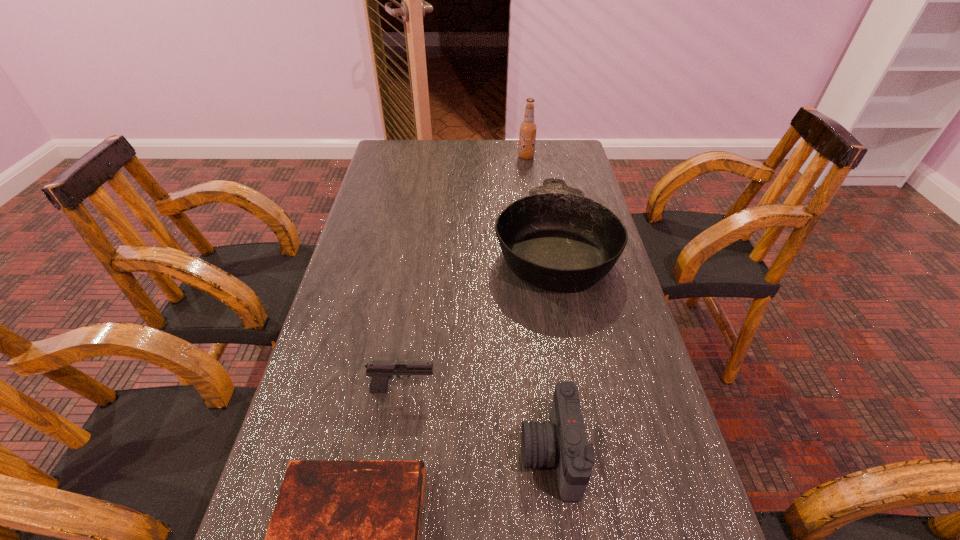
Identify the location of beer bottle. (527, 137).

The width and height of the screenshot is (960, 540). Identify the location of the farthest object. (527, 137).

You are a GUI agent. You are given a task and a screenshot of the screen. Output one action in this format:
    pyautogui.click(x=<x>, y=<y>)
    Task: Click on the frying pan
    
    Given the screenshot: What is the action you would take?
    point(556,239)

The height and width of the screenshot is (540, 960). In order to click on camera in this screenshot , I will do `click(562, 441)`.

I want to click on pistol, so click(x=380, y=372).

In order to click on the second shortest object in this screenshot , I will do `click(380, 372)`.

Locate an element on the screen. This screenshot has width=960, height=540. vacant position located 0.290m on the front label of the farthest object is located at coordinates (439, 157).

At what (x,y) coordinates should I click in order to perform the action: click on vacant position located on the front label of the farthest object. Please return your answer as a coordinate pair (x, y). Looking at the image, I should click on (449, 157).

Find the location of `vacant space positioned 0.230m on the front label of the farthest object`. vacant space positioned 0.230m on the front label of the farthest object is located at coordinates (455, 157).

Locate an element on the screen. vacant space located with the handle extending from the side of the frying pan is located at coordinates (538, 164).